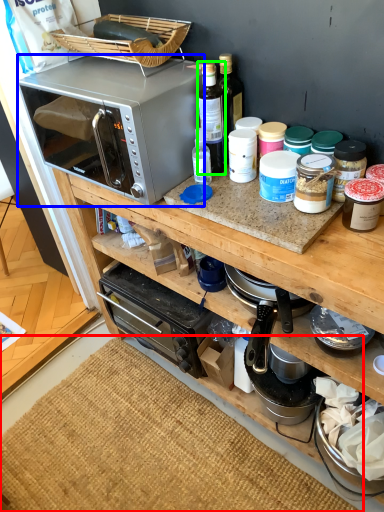
Question: Which object is the closest to the mat (highlighted by a red box)? Choose among these: microwave oven (highlighted by a blue box) or bottle (highlighted by a green box).

Choices:
 (A) microwave oven
 (B) bottle

Answer: (A)